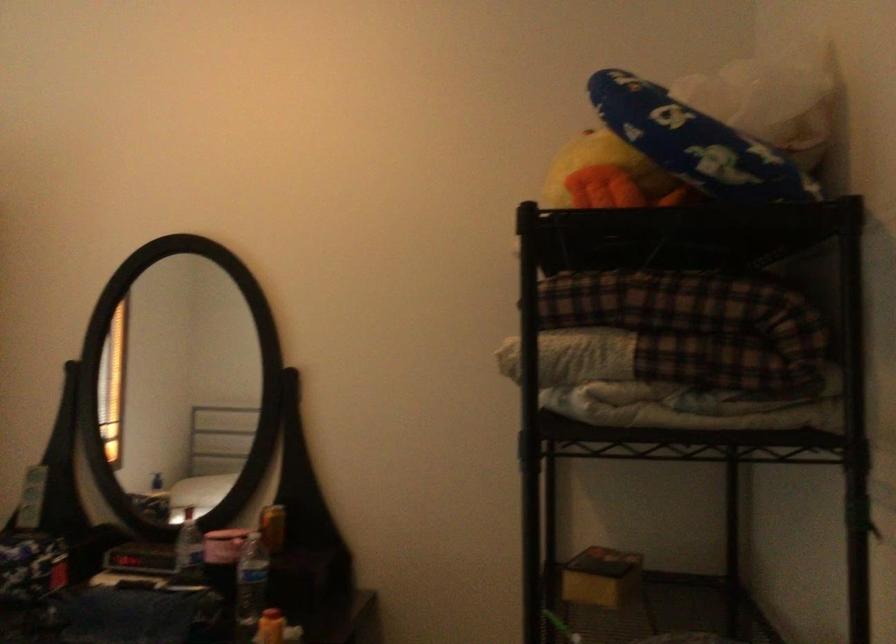
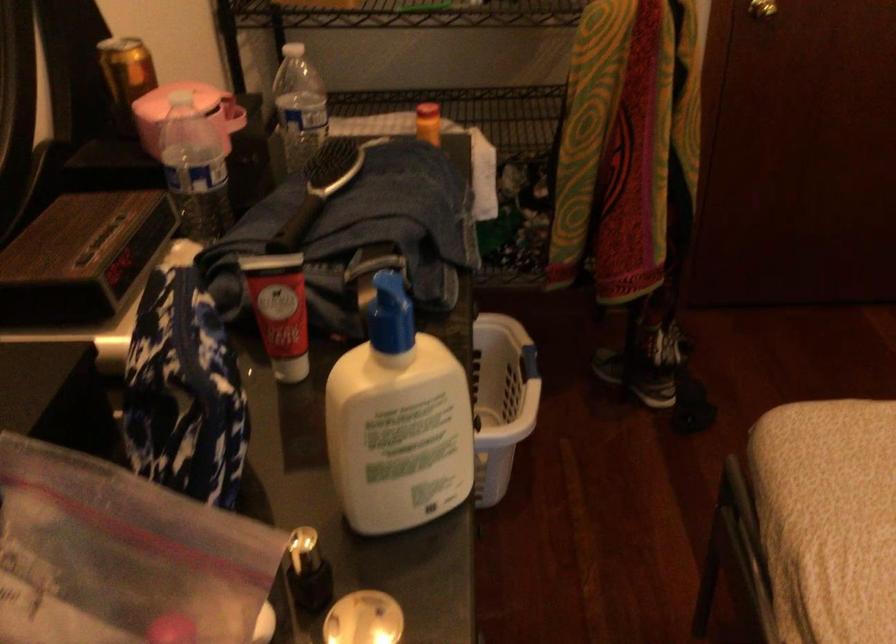
Find the pixel in the second image that matches point 247,565 in the first image.

(298, 106)